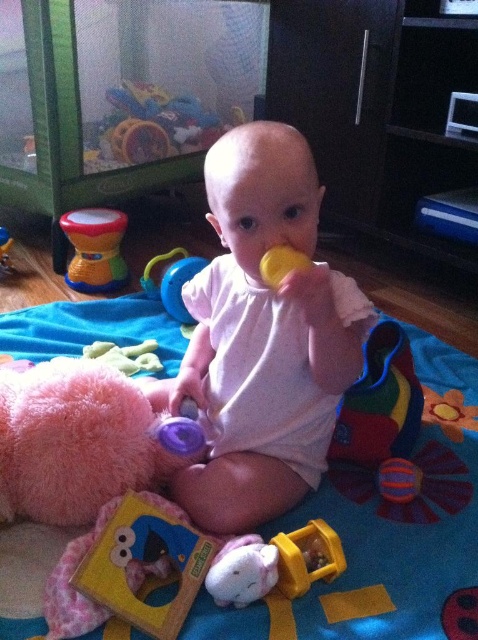
Question: Among these points, which one is farthest from the camera?

Choices:
 (A) (282, 262)
 (B) (1, 232)

Answer: (B)

Question: Does rubberized plastic rattle at left appear on the right side of rubberized yellow teething ring at center?

Choices:
 (A) no
 (B) yes

Answer: (B)

Question: Does multicolored fabric ball at lower right come in front of rubberized plastic rattle at left?

Choices:
 (A) yes
 (B) no

Answer: (A)

Question: Which point is farther to the camera?

Choices:
 (A) click(x=381, y=467)
 (B) click(x=325, y=545)
 (C) click(x=83, y=275)

Answer: (C)

Question: Is yellow plastic teether at center below rubberized yellow teething ring at center?

Choices:
 (A) yes
 (B) no

Answer: (A)

Question: Which is farther from the blue soft mat at center?

Choices:
 (A) yellow rubber duck at center
 (B) rubberized yellow teething ring at center
 (C) rubberized plastic ball at upper center
 (D) pink matte onesie at center

Answer: (B)